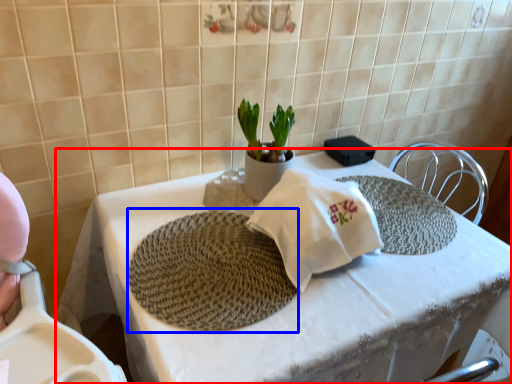
Question: Among these objects, which one is farthest to the camera, table (highlighted by a red box) or mat (highlighted by a blue box)?

Choices:
 (A) table
 (B) mat

Answer: (B)